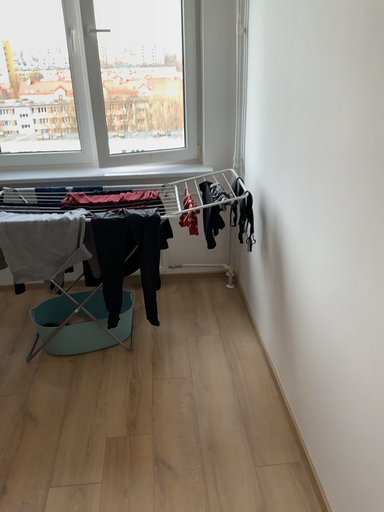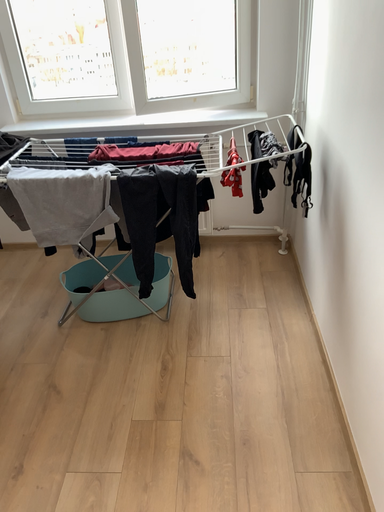
Question: Which way did the camera rotate in the video?

Choices:
 (A) rotated left
 (B) rotated right

Answer: (A)